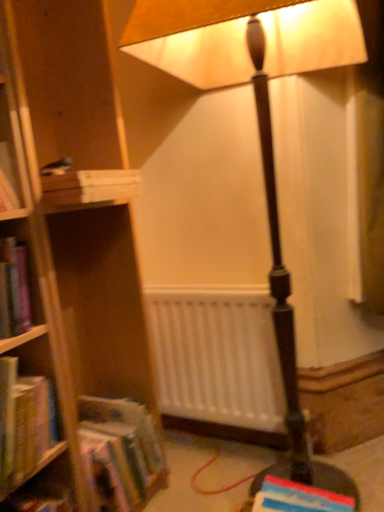
Question: Is hardcover book at left, the 2th book from the top, at the left side of matte brown lamp at center?

Choices:
 (A) no
 (B) yes

Answer: (B)

Question: Can you confirm if hardcover book at left, the 2th book from the top, is bigger than matte brown lamp at center?

Choices:
 (A) no
 (B) yes

Answer: (A)

Question: Is the position of hardcover book at left, the 2th book from the top, more distant than that of matte brown lamp at center?

Choices:
 (A) yes
 (B) no

Answer: (A)

Question: Considering the relative positions of hardcover book at left, the 3th book ordered from the bottom, and matte brown lamp at center in the image provided, is hardcover book at left, the 3th book ordered from the bottom, to the right of matte brown lamp at center from the viewer's perspective?

Choices:
 (A) yes
 (B) no

Answer: (B)

Question: Is hardcover book at left, the 3th book ordered from the bottom, surrounding matte brown lamp at center?

Choices:
 (A) yes
 (B) no

Answer: (B)

Question: From a real-world perspective, is matte brown lamp at center above or below wooden crate at left, which appears as the 1th book when viewed from the top?

Choices:
 (A) below
 (B) above

Answer: (A)

Question: Is matte brown lamp at center wider or thinner than wooden crate at left, acting as the 4th book starting from the bottom?

Choices:
 (A) wide
 (B) thin

Answer: (A)

Question: Based on their positions, is matte brown lamp at center located to the left or right of wooden crate at left, acting as the 4th book starting from the bottom?

Choices:
 (A) right
 (B) left

Answer: (A)

Question: Which is correct: matte brown lamp at center is inside wooden crate at left, which appears as the 1th book when viewed from the top, or outside of it?

Choices:
 (A) inside
 (B) outside

Answer: (B)

Question: Is point (1, 376) closer or farther from the camera than point (43, 190)?

Choices:
 (A) farther
 (B) closer

Answer: (B)

Question: From a real-world perspective, is hardcover book at left, the 3th book ordered from the bottom, positioned above or below wooden crate at left, which appears as the 1th book when viewed from the top?

Choices:
 (A) above
 (B) below

Answer: (B)

Question: Looking at their shapes, would you say hardcover book at left, the 2th book from the top, is wider or thinner than wooden crate at left, which appears as the 1th book when viewed from the top?

Choices:
 (A) wide
 (B) thin

Answer: (B)

Question: Based on their sizes in the image, would you say hardcover book at left, the 2th book from the top, is bigger or smaller than wooden crate at left, which appears as the 1th book when viewed from the top?

Choices:
 (A) small
 (B) big

Answer: (B)

Question: Is point (294, 508) positioned closer to the camera than point (182, 366)?

Choices:
 (A) closer
 (B) farther

Answer: (A)

Question: From a real-world perspective, relative to white matte radiator at center, is hardcover book at lower right, the fourth book positioned from the top, vertically above or below?

Choices:
 (A) below
 (B) above

Answer: (A)